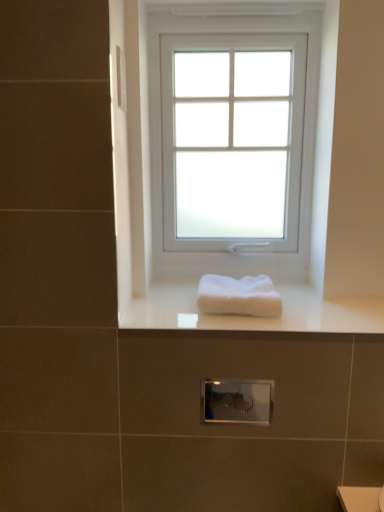
Question: From the image's perspective, is white frosted glass window at center located above white glossy towel at center?

Choices:
 (A) yes
 (B) no

Answer: (A)

Question: Is the surface of white frosted glass window at center in direct contact with white glossy towel at center?

Choices:
 (A) no
 (B) yes

Answer: (A)

Question: Is white frosted glass window at center aimed at white glossy towel at center?

Choices:
 (A) yes
 (B) no

Answer: (A)

Question: Does white frosted glass window at center have a larger size compared to white glossy towel at center?

Choices:
 (A) no
 (B) yes

Answer: (B)

Question: Can we say white frosted glass window at center lies outside white glossy towel at center?

Choices:
 (A) no
 (B) yes

Answer: (B)

Question: Is white glossy towel at center located within white frosted glass window at center?

Choices:
 (A) yes
 (B) no

Answer: (B)

Question: Is white frosted glass window at center at the left side of white fluffy towel at center?

Choices:
 (A) no
 (B) yes

Answer: (A)

Question: Is white frosted glass window at center wider than white fluffy towel at center?

Choices:
 (A) no
 (B) yes

Answer: (A)

Question: Is white frosted glass window at center looking in the opposite direction of white fluffy towel at center?

Choices:
 (A) no
 (B) yes

Answer: (A)

Question: From the image's perspective, is white frosted glass window at center located above white fluffy towel at center?

Choices:
 (A) no
 (B) yes

Answer: (B)

Question: Is white frosted glass window at center outside white fluffy towel at center?

Choices:
 (A) yes
 (B) no

Answer: (A)

Question: Does white frosted glass window at center turn towards white fluffy towel at center?

Choices:
 (A) yes
 (B) no

Answer: (A)

Question: From the image's perspective, is white fluffy towel at center on white glossy towel at center?

Choices:
 (A) yes
 (B) no

Answer: (A)